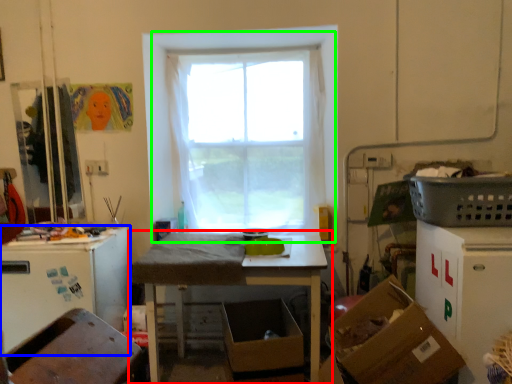
Question: Based on their relative distances, which object is farther from table (highlighted by a red box)? Choose from leftover (highlighted by a blue box) and window (highlighted by a green box).

Choices:
 (A) leftover
 (B) window

Answer: (B)